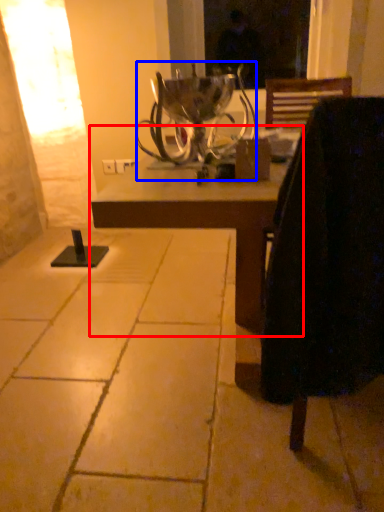
Question: Which object appears farthest to the camera in this image, table (highlighted by a red box) or candle holder (highlighted by a blue box)?

Choices:
 (A) table
 (B) candle holder

Answer: (B)